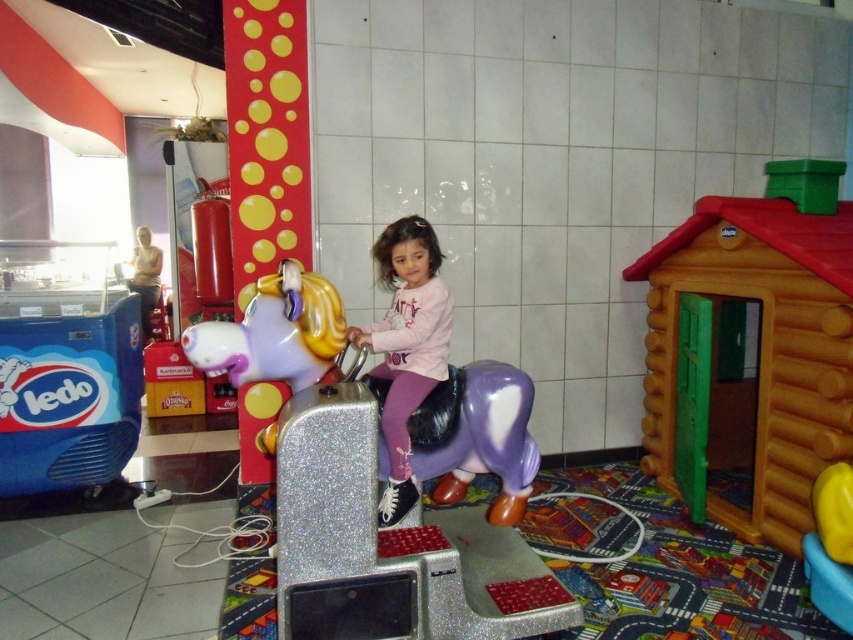
Question: Is orange plastic playhouse at right positioned behind pink matte unicorn at center?

Choices:
 (A) no
 (B) yes

Answer: (B)

Question: Which object is positioned farthest from the pink matte unicorn at center?

Choices:
 (A) orange plastic playhouse at right
 (B) shiny purple plastic horse at center

Answer: (A)

Question: Can you confirm if shiny purple plastic horse at center is wider than pink matte unicorn at center?

Choices:
 (A) yes
 (B) no

Answer: (A)

Question: Which point is closer to the camera taking this photo?

Choices:
 (A) (537, 608)
 (B) (393, 464)

Answer: (A)

Question: Is orange plastic playhouse at right bigger than pink matte unicorn at center?

Choices:
 (A) yes
 (B) no

Answer: (A)

Question: Which of the following is the closest to the observer?

Choices:
 (A) (431, 346)
 (B) (527, 397)
 (C) (714, 269)

Answer: (A)